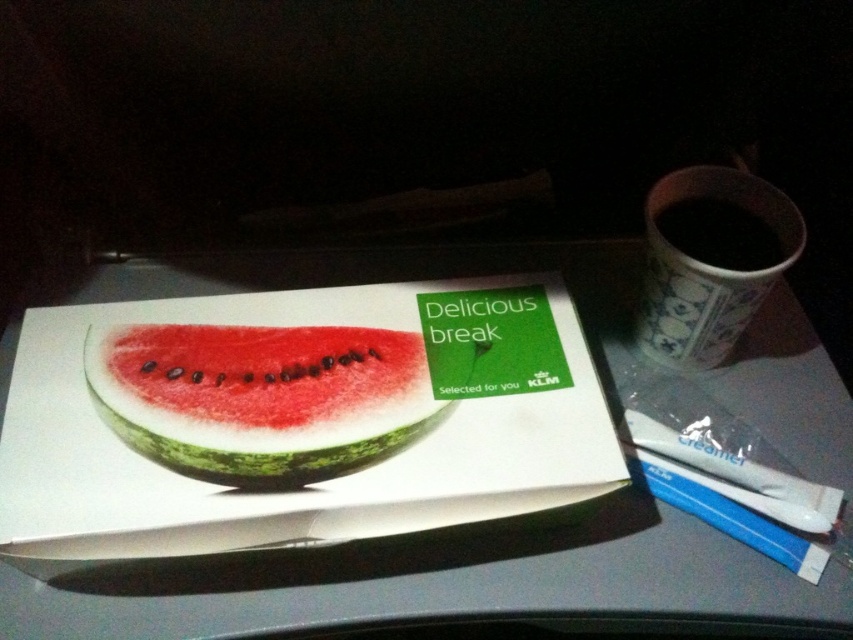
Question: Which point is closer to the camera taking this photo?

Choices:
 (A) (306, 634)
 (B) (704, 330)
 (C) (326, 451)

Answer: (C)

Question: Does white plastic tray at center have a greater width compared to black glossy cup at upper right?

Choices:
 (A) yes
 (B) no

Answer: (A)

Question: Estimate the real-world distances between objects in this image. Which object is closer to the green matte watermelon at center?

Choices:
 (A) white plastic tray at center
 (B) black glossy cup at upper right

Answer: (A)

Question: Can you confirm if green matte watermelon at center is positioned to the left of black glossy cup at upper right?

Choices:
 (A) yes
 (B) no

Answer: (A)

Question: Estimate the real-world distances between objects in this image. Which object is farther from the white plastic tray at center?

Choices:
 (A) black glossy cup at upper right
 (B) green matte watermelon at center

Answer: (A)

Question: Where is white plastic tray at center located in relation to green matte watermelon at center in the image?

Choices:
 (A) above
 (B) below

Answer: (B)